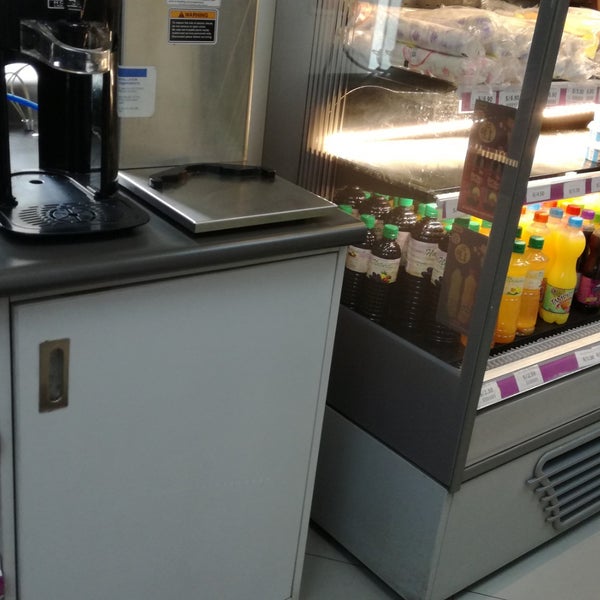
You are a GUI agent. You are given a task and a screenshot of the screen. Output one action in this format:
    pyautogui.click(x=<x>, y=<y>)
    Task: Click on the grout line in tile floor
    
    Given the screenshot: What is the action you would take?
    pyautogui.click(x=323, y=557), pyautogui.click(x=483, y=595)